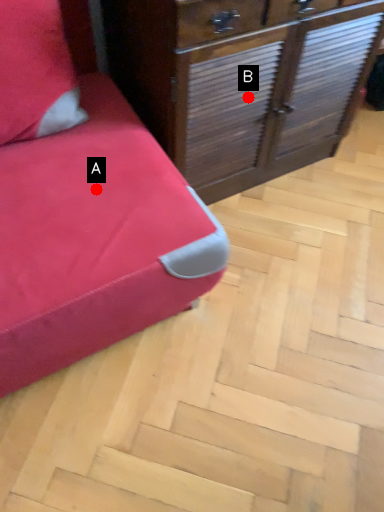
Question: Two points are circled on the image, labeled by A and B beside each circle. Which point is further to the camera?

Choices:
 (A) A is further
 (B) B is further

Answer: (B)